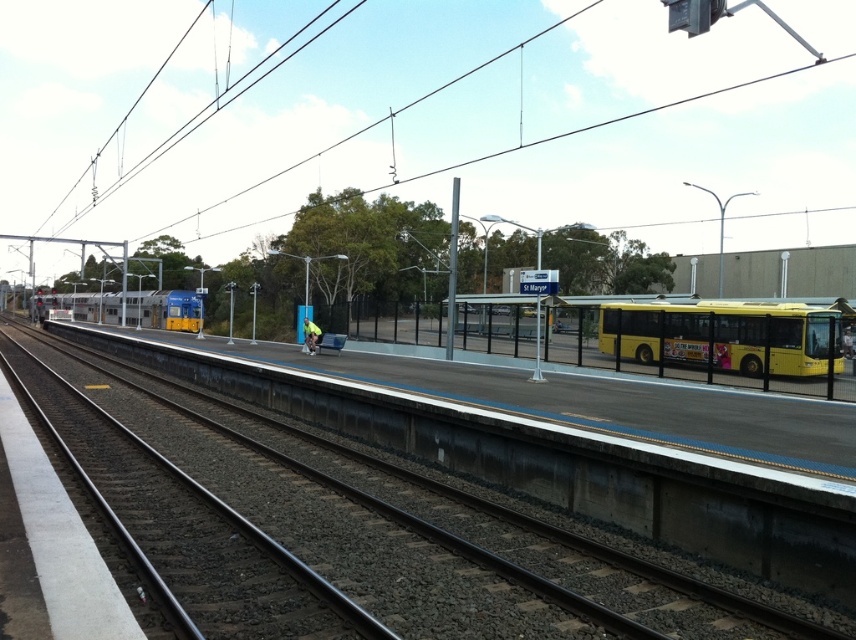
Question: Which is farther from the metal train track at center?

Choices:
 (A) metallic wire at upper center
 (B) silver metallic train at center

Answer: (A)

Question: Which of these objects is positioned farthest from the metallic wire at upper center?

Choices:
 (A) yellow matte bus at right
 (B) metal train track at center
 (C) silver metallic train at center

Answer: (B)

Question: Can you confirm if metallic wire at upper center is positioned to the left of silver metallic train at center?

Choices:
 (A) no
 (B) yes

Answer: (A)

Question: Which is nearer to the yellow matte bus at right?

Choices:
 (A) silver metallic train at center
 (B) metal train track at center
 (C) metallic wire at upper center

Answer: (B)

Question: From the image, what is the correct spatial relationship of metallic wire at upper center in relation to metal train track at center?

Choices:
 (A) below
 (B) above

Answer: (B)

Question: Can you confirm if metallic wire at upper center is smaller than silver metallic train at center?

Choices:
 (A) no
 (B) yes

Answer: (A)